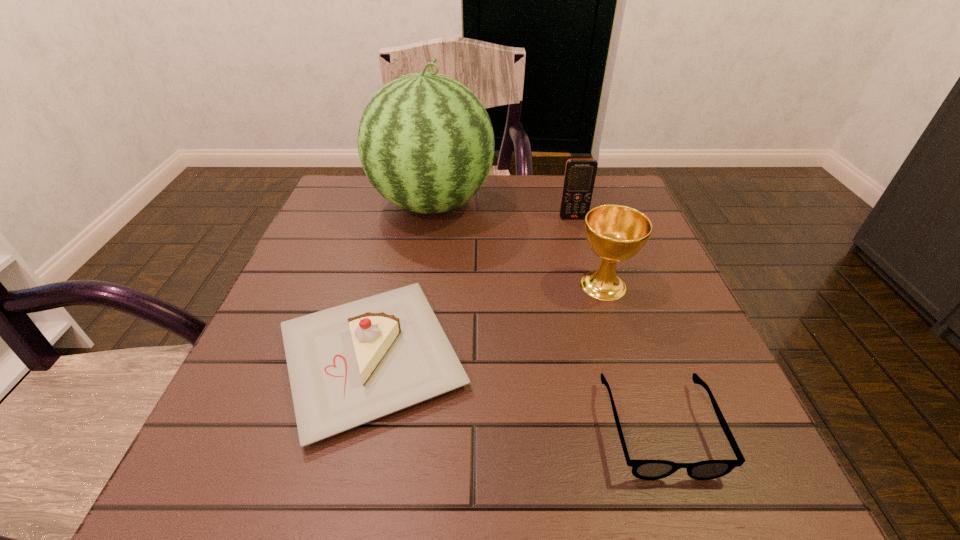
Locate an element on the screen. This screenshot has height=540, width=960. object at the far right corner is located at coordinates (580, 174).

The image size is (960, 540). What are the coordinates of `object that is positioned at the near right corner` in the screenshot? It's located at (642, 469).

You are a GUI agent. You are given a task and a screenshot of the screen. Output one action in this format:
    pyautogui.click(x=<x>, y=<y>)
    Task: Click on the vacant space at the far edge of the desktop
    This screenshot has height=540, width=960.
    Given the screenshot: What is the action you would take?
    pyautogui.click(x=474, y=206)

The image size is (960, 540). Find the location of `free space at the left edge of the desktop`. free space at the left edge of the desktop is located at coordinates (349, 227).

This screenshot has width=960, height=540. Identify the location of vacant space at the right edge of the desktop. (678, 360).

In order to click on blank area at the far left corner in this screenshot , I will do point(365,183).

Identify the location of vacant space at the far right corner of the desktop. Image resolution: width=960 pixels, height=540 pixels. [633, 197].

Locate an element on the screen. free space at the near right corner is located at coordinates (653, 453).

Where is `vacant point located between the spectacles and the cellular telephone`? The height and width of the screenshot is (540, 960). vacant point located between the spectacles and the cellular telephone is located at coordinates (616, 322).

Identify the location of free spot between the cellular telephone and the spectacles. (616, 322).